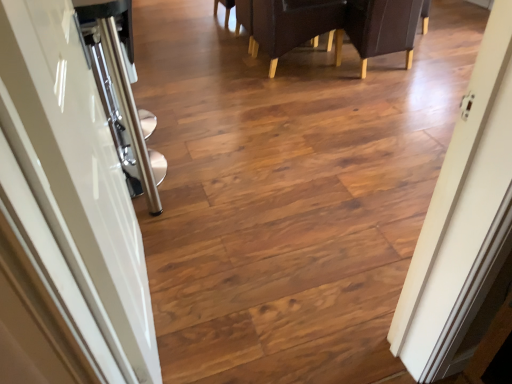
Identify the location of free space in front of leather-like dark brown chair at upper center. Image resolution: width=512 pixels, height=384 pixels. (335, 107).